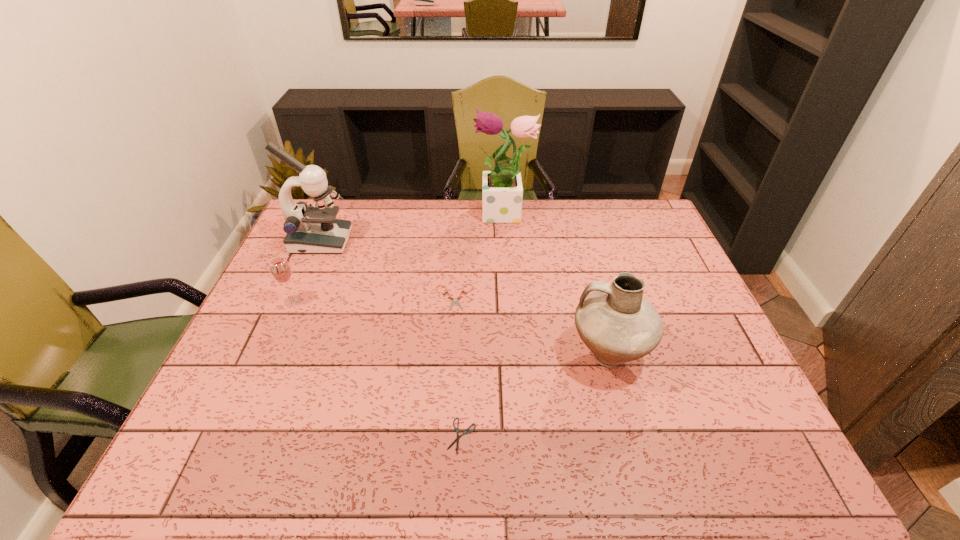
The image size is (960, 540). What are the coordinates of `flower arrangement` in the screenshot? It's located at (502, 192).

Where is `microscope`? Image resolution: width=960 pixels, height=540 pixels. microscope is located at coordinates (310, 229).

Find the location of a particular element. the rightmost object is located at coordinates (618, 325).

Find the location of a particular element. Image resolution: width=960 pixels, height=540 pixels. the third tallest object is located at coordinates (618, 325).

This screenshot has width=960, height=540. What are the coordinates of `wineglass` in the screenshot? It's located at (281, 271).

Image resolution: width=960 pixels, height=540 pixels. I want to click on the taller shears, so click(455, 300).

At what (x,y) coordinates should I click in order to perform the action: click on the farther shears. Please return your answer as a coordinate pair (x, y). Looking at the image, I should click on (455, 300).

The image size is (960, 540). Identify the location of the shortest object. (465, 432).

You are a GUI agent. You are given a task and a screenshot of the screen. Output one action in this format:
    pyautogui.click(x=<x>, y=<y>)
    Task: Click on the nearer shears
    
    Given the screenshot: What is the action you would take?
    pyautogui.click(x=465, y=432)

At what (x,y) coordinates should I click in order to perform the action: click on free spot located 0.260m on the front-facing side of the flower arrangement. Please return your answer as a coordinate pair (x, y). The width and height of the screenshot is (960, 540). Looking at the image, I should click on (402, 215).